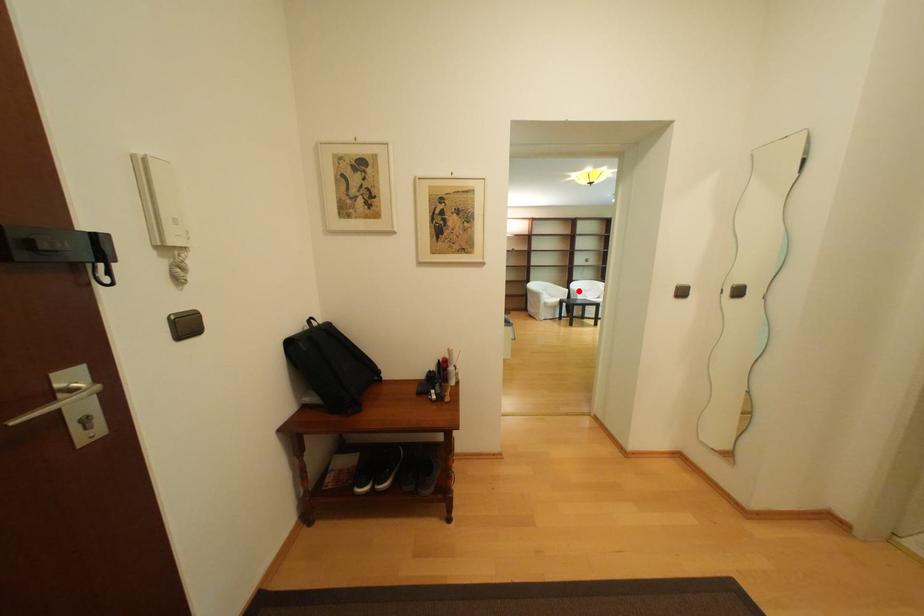
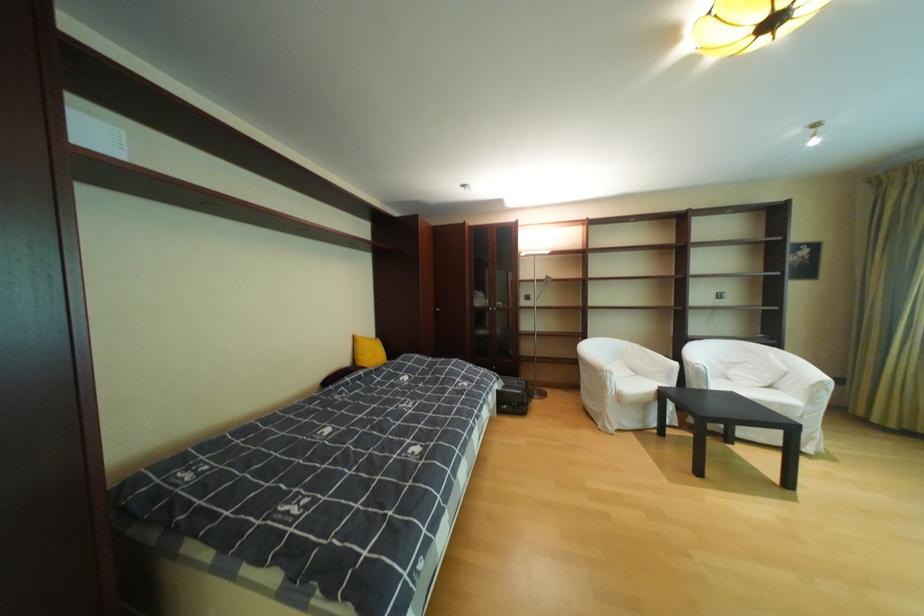
Question: I am providing you with two images of the same scene from different viewpoints. Image1 has a red point marked. In image2, the corresponding 3D location appears at what relative position? Reply with the corresponding letter.

Choices:
 (A) Closer
 (B) Farther

Answer: (B)